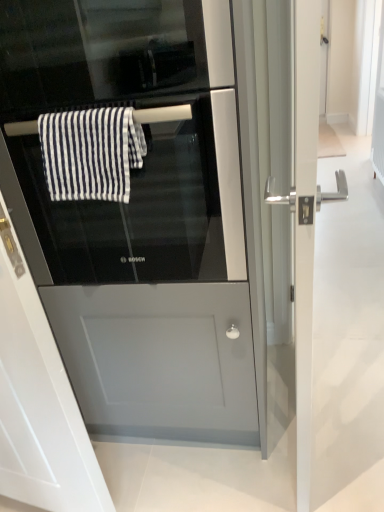
Identify the location of vacant space to the left of silver metallic door handle at right, positioned as the 1th screen door in right-to-left order. (223, 453).